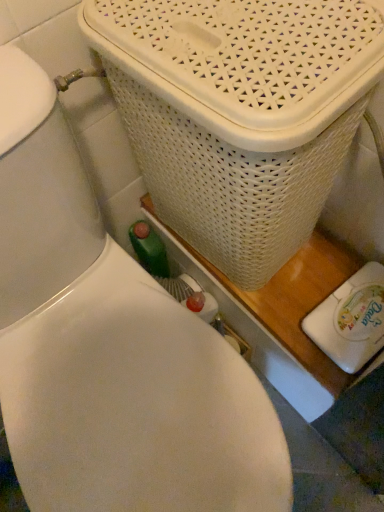
Identify the location of white plastic toilet brush at lower right. Image resolution: width=384 pixels, height=512 pixels. (351, 320).

The image size is (384, 512). Describe the element at coordinates (351, 320) in the screenshot. I see `white plastic toilet brush at lower right` at that location.

You are a GUI agent. You are given a task and a screenshot of the screen. Output one action in this format:
    pyautogui.click(x=<x>, y=<y>)
    Task: Click on the white woven basket at upper right
    Image resolution: width=384 pixels, height=512 pixels.
    Given the screenshot: What is the action you would take?
    pyautogui.click(x=239, y=113)

What do you see at coordinates (239, 113) in the screenshot?
I see `white woven basket at upper right` at bounding box center [239, 113].

Where is `white plastic toilet brush at lower right`? Image resolution: width=384 pixels, height=512 pixels. white plastic toilet brush at lower right is located at coordinates (351, 320).

Considering the positions of objects white plastic toilet brush at lower right and white woven basket at upper right in the image provided, who is more to the left, white plastic toilet brush at lower right or white woven basket at upper right?

white woven basket at upper right is more to the left.

Between white plastic toilet brush at lower right and white woven basket at upper right, which one is positioned behind?

white plastic toilet brush at lower right is more distant.

Is point (370, 350) less distant than point (218, 153)?

That is False.

From the image's perspective, which one is positioned lower, white plastic toilet brush at lower right or white woven basket at upper right?

white plastic toilet brush at lower right is shown below in the image.

From a real-world perspective, is white plastic toilet brush at lower right physically above white woven basket at upper right?

No, from a real-world perspective, white plastic toilet brush at lower right is not above white woven basket at upper right.

Is white plastic toilet brush at lower right wider or thinner than white woven basket at upper right?

In the image, white plastic toilet brush at lower right appears to be more narrow than white woven basket at upper right.

Is white plastic toilet brush at lower right taller or shorter than white woven basket at upper right?

Clearly, white plastic toilet brush at lower right is shorter compared to white woven basket at upper right.

Based on their sizes in the image, would you say white plastic toilet brush at lower right is bigger or smaller than white woven basket at upper right?

Considering their sizes, white plastic toilet brush at lower right takes up less space than white woven basket at upper right.

Is white plastic toilet brush at lower right located outside white woven basket at upper right?

Yes.

Looking at this image, is white plastic toilet brush at lower right in contact with white woven basket at upper right?

No, white plastic toilet brush at lower right is not making contact with white woven basket at upper right.

Does white plastic toilet brush at lower right turn towards white woven basket at upper right?

No.

How different are the orientations of white plastic toilet brush at lower right and white woven basket at upper right in degrees?

The angular difference between white plastic toilet brush at lower right and white woven basket at upper right is 0.000182 degrees.

Where is `basket container that is above the white plastic toilet brush at lower right (from the image's perspective)`? The height and width of the screenshot is (512, 384). basket container that is above the white plastic toilet brush at lower right (from the image's perspective) is located at coordinates (239, 113).

Is white woven basket at upper right at the left side of white plastic toilet brush at lower right?

Yes.

Is the depth of white woven basket at upper right greater than that of white plastic toilet brush at lower right?

No, the depth of white woven basket at upper right is less than that of white plastic toilet brush at lower right.

Considering the positions of point (151, 11) and point (351, 337), is point (151, 11) closer or farther from the camera than point (351, 337)?

Point (151, 11) is closer to the camera than point (351, 337).

From the image's perspective, which is above, white woven basket at upper right or white plastic toilet brush at lower right?

From the image's view, white woven basket at upper right is above.

From a real-world perspective, is white woven basket at upper right located higher than white plastic toilet brush at lower right?

Yes, from a real-world perspective, white woven basket at upper right is over white plastic toilet brush at lower right

Between white woven basket at upper right and white plastic toilet brush at lower right, which one has smaller width?

white plastic toilet brush at lower right.

Looking at this image, between white woven basket at upper right and white plastic toilet brush at lower right, which one has more height?

Standing taller between the two is white woven basket at upper right.

Does white woven basket at upper right have a larger size compared to white plastic toilet brush at lower right?

Indeed, white woven basket at upper right has a larger size compared to white plastic toilet brush at lower right.

Is white woven basket at upper right completely or partially outside of white plastic toilet brush at lower right?

Yes, white woven basket at upper right is outside of white plastic toilet brush at lower right.

Is white woven basket at upper right positioned far away from white plastic toilet brush at lower right?

No, white woven basket at upper right is in close proximity to white plastic toilet brush at lower right.

Looking at this image, is white woven basket at upper right positioned with its back to white plastic toilet brush at lower right?

No, white woven basket at upper right's orientation is not away from white plastic toilet brush at lower right.

Consider the image. How many degrees apart are the facing directions of white woven basket at upper right and white plastic toilet brush at lower right?

They differ by 0.000182 degrees in their facing directions.

Locate an element on the screen. basket container in front of the white plastic toilet brush at lower right is located at coordinates (239, 113).

Where is `appliance on the right of the white woven basket at upper right`? appliance on the right of the white woven basket at upper right is located at coordinates (351, 320).

Identify the location of basket container on the left of white plastic toilet brush at lower right. (239, 113).